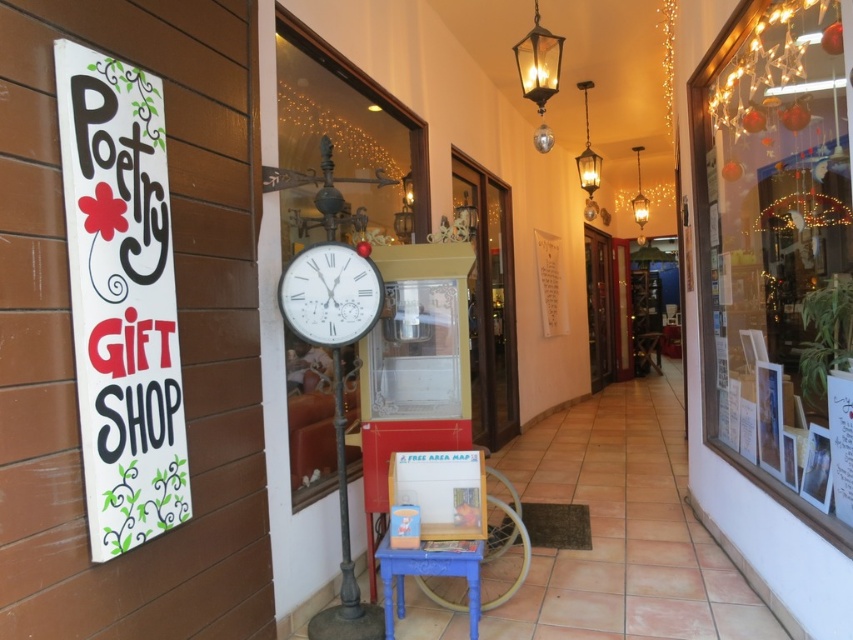
Question: Which object is the closest to the blue painted wood stool at center?

Choices:
 (A) white painted wood sign at left
 (B) white glossy clock at center

Answer: (B)

Question: Can you confirm if white painted wood sign at left is positioned above blue painted wood stool at center?

Choices:
 (A) no
 (B) yes

Answer: (B)

Question: Considering the real-world distances, which object is farthest from the clear glass display case at right?

Choices:
 (A) white painted wood sign at left
 (B) white glossy clock at center
 (C) blue painted wood stool at center

Answer: (A)

Question: Which object appears closest to the camera in this image?

Choices:
 (A) blue painted wood stool at center
 (B) white painted wood sign at left
 (C) clear glass display case at right
 (D) white glossy clock at center

Answer: (B)

Question: Is clear glass display case at right behind white painted wood sign at left?

Choices:
 (A) yes
 (B) no

Answer: (A)

Question: Considering the relative positions of white glossy clock at center and blue painted wood stool at center in the image provided, where is white glossy clock at center located with respect to blue painted wood stool at center?

Choices:
 (A) left
 (B) right

Answer: (A)